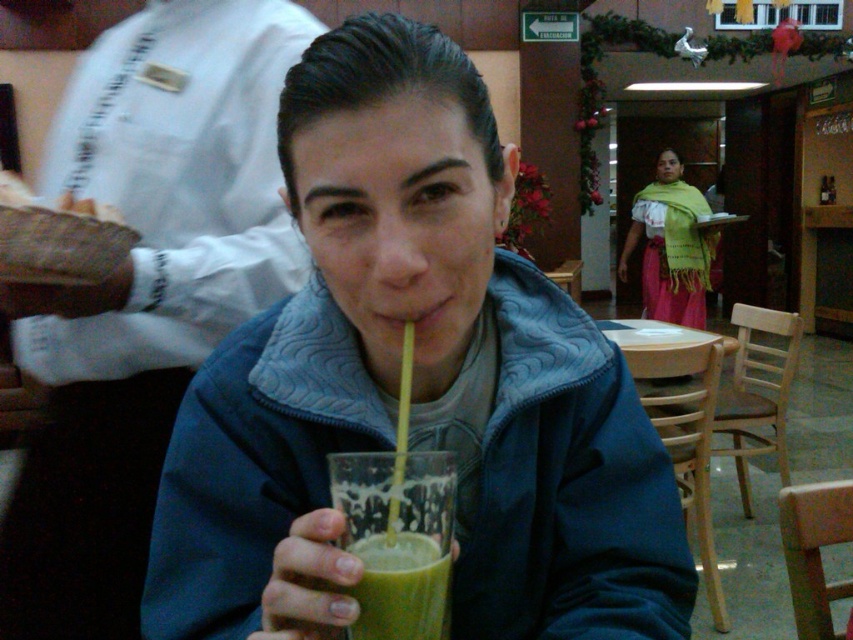
Can you confirm if green woven scarf at center is positioned to the left of green smoothie at center?

Incorrect, green woven scarf at center is not on the left side of green smoothie at center.

Can you confirm if green woven scarf at center is thinner than green smoothie at center?

No, green woven scarf at center is not thinner than green smoothie at center.

Who is more forward, (689,276) or (432,561)?

Point (432,561) is in front.

Where is `green woven scarf at center`? green woven scarf at center is located at coordinates (670, 244).

Can you confirm if matte glass cup at center is positioned above green translucent cup at center?

Yes, matte glass cup at center is above green translucent cup at center.

Between matte glass cup at center and green translucent cup at center, which one has less height?

green translucent cup at center is shorter.

Does point (325, 278) come behind point (334, 468)?

Yes, it is behind point (334, 468).

At what (x,y) coordinates should I click in order to perform the action: click on matte glass cup at center. Please return your answer as a coordinate pair (x, y). Looking at the image, I should click on pyautogui.click(x=413, y=387).

Between matte glass cup at center and green woven scarf at center, which one has less height?

With less height is matte glass cup at center.

Can you confirm if matte glass cup at center is positioned to the right of green woven scarf at center?

In fact, matte glass cup at center is to the left of green woven scarf at center.

What are the coordinates of `matte glass cup at center` in the screenshot? It's located at (413, 387).

Image resolution: width=853 pixels, height=640 pixels. I want to click on matte glass cup at center, so pos(413,387).